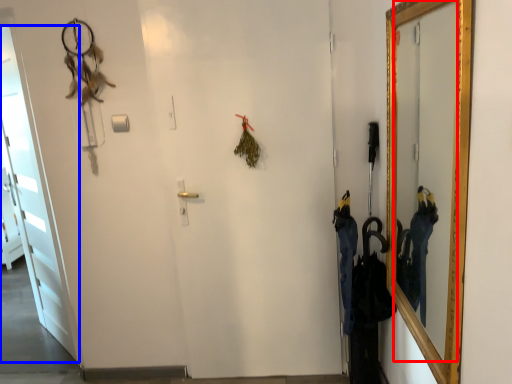
Question: Among these objects, which one is farthest to the camera, mirror (highlighted by a red box) or door (highlighted by a blue box)?

Choices:
 (A) mirror
 (B) door

Answer: (B)